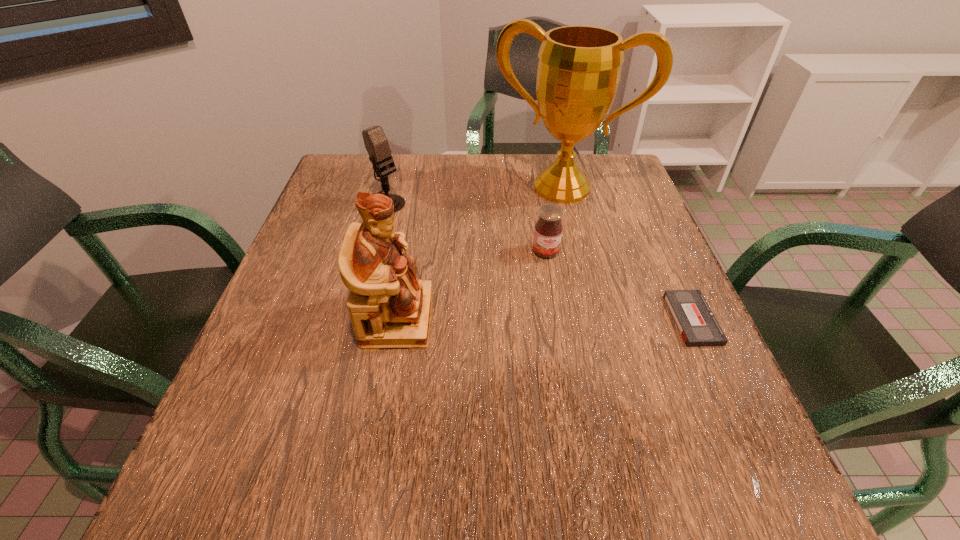
The image size is (960, 540). What are the coordinates of `videotape that is at the right edge` in the screenshot? It's located at click(x=696, y=323).

Where is `award present at the right edge`? award present at the right edge is located at coordinates (579, 68).

Where is `object that is positioned at the far left corner`? The height and width of the screenshot is (540, 960). object that is positioned at the far left corner is located at coordinates pos(376,143).

Locate an element on the screen. This screenshot has height=540, width=960. object located in the far right corner section of the desktop is located at coordinates (579, 68).

At what (x,y) coordinates should I click in order to perform the action: click on vacant space at the far edge of the desktop. Please return your answer as a coordinate pair (x, y). The image size is (960, 540). Looking at the image, I should click on (412, 176).

In the image, there is a desktop. Where is `free space at the left edge`? free space at the left edge is located at coordinates (326, 318).

Where is `vacant space at the right edge`? vacant space at the right edge is located at coordinates (589, 219).

Identify the location of vacant region at the far left corner of the desktop. This screenshot has height=540, width=960. [x=338, y=165].

The width and height of the screenshot is (960, 540). Find the location of `vacant space at the far right corner of the desktop`. vacant space at the far right corner of the desktop is located at coordinates (616, 174).

Image resolution: width=960 pixels, height=540 pixels. I want to click on blank region between the shortest object and the award, so click(627, 253).